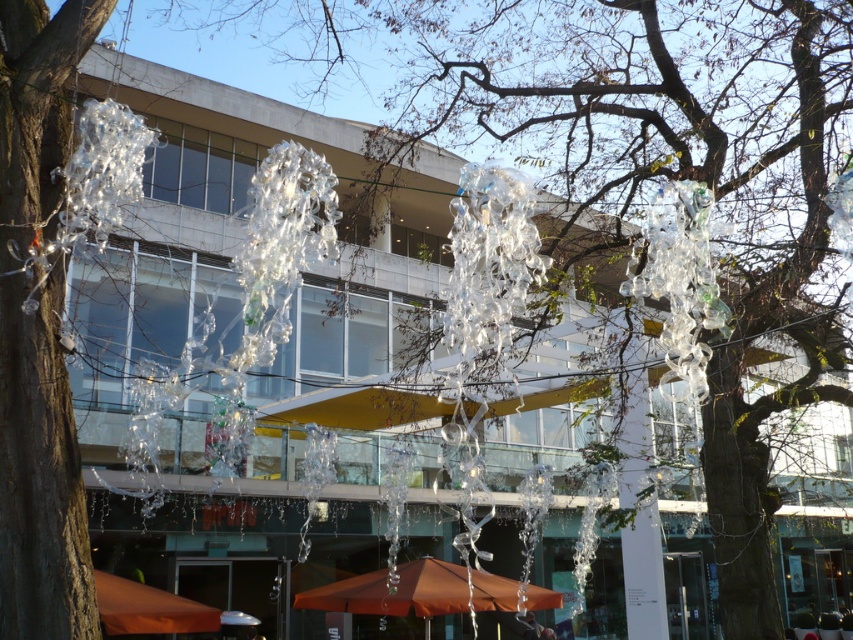
What do you see at coordinates (426, 593) in the screenshot? The height and width of the screenshot is (640, 853). I see `orange fabric umbrella at center` at bounding box center [426, 593].

Does orange fabric umbrella at center have a larger size compared to orange fabric umbrella at lower left?

Correct, orange fabric umbrella at center is larger in size than orange fabric umbrella at lower left.

I want to click on orange fabric umbrella at center, so click(x=426, y=593).

Where is `orange fabric umbrella at center`? The height and width of the screenshot is (640, 853). orange fabric umbrella at center is located at coordinates (426, 593).